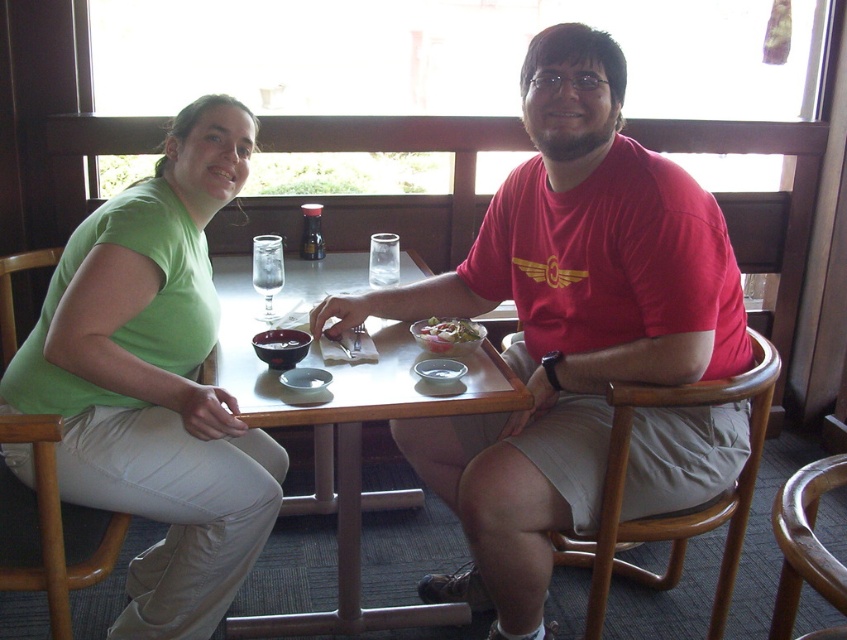
You are a waiter in a restaurant and need to place a new order for the customer wearing the red matte shirt at center. Where should you place the dish relative to their current position?

The dish should be placed near the location of the red matte shirt at center, which is at point 2D coordinates [563,323].